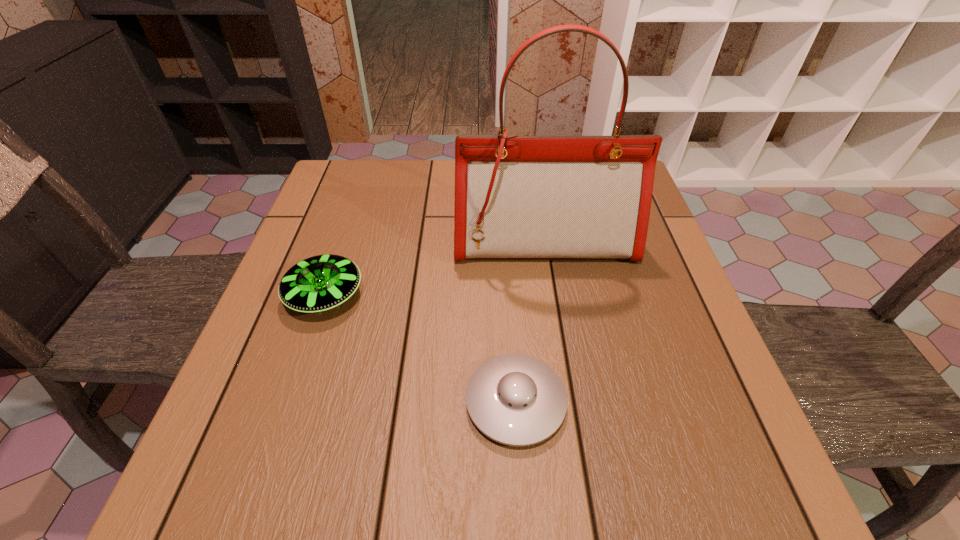
Where is `free space that is in between the right saucer and the farther saucer`? free space that is in between the right saucer and the farther saucer is located at coordinates (420, 349).

Find the location of a particular element. The height and width of the screenshot is (540, 960). vacant area that lies between the nearer saucer and the second nearest object is located at coordinates (420, 349).

Where is `free space between the taller saucer and the tallest object`? The height and width of the screenshot is (540, 960). free space between the taller saucer and the tallest object is located at coordinates (435, 270).

Identify the location of unoccupied area between the shorter saucer and the taller saucer. The height and width of the screenshot is (540, 960). (420, 349).

The height and width of the screenshot is (540, 960). I want to click on unoccupied area between the right saucer and the left saucer, so click(x=420, y=349).

Find the location of `vacant space that is in between the handbag and the farther saucer`. vacant space that is in between the handbag and the farther saucer is located at coordinates (435, 270).

Identify the location of object that ranks as the closest to the farthest object. Image resolution: width=960 pixels, height=540 pixels. (319, 283).

Locate an element on the screen. This screenshot has height=540, width=960. object that stands as the second closest to the farther saucer is located at coordinates (514, 399).

Image resolution: width=960 pixels, height=540 pixels. Identify the location of free space in the image that satisfies the following two spatial constraints: 1. on the back side of the farther saucer; 2. on the left side of the handbag. (342, 245).

The height and width of the screenshot is (540, 960). Identify the location of vacant region that satisfies the following two spatial constraints: 1. on the front side of the shortest object; 2. on the right side of the second farthest object. (289, 402).